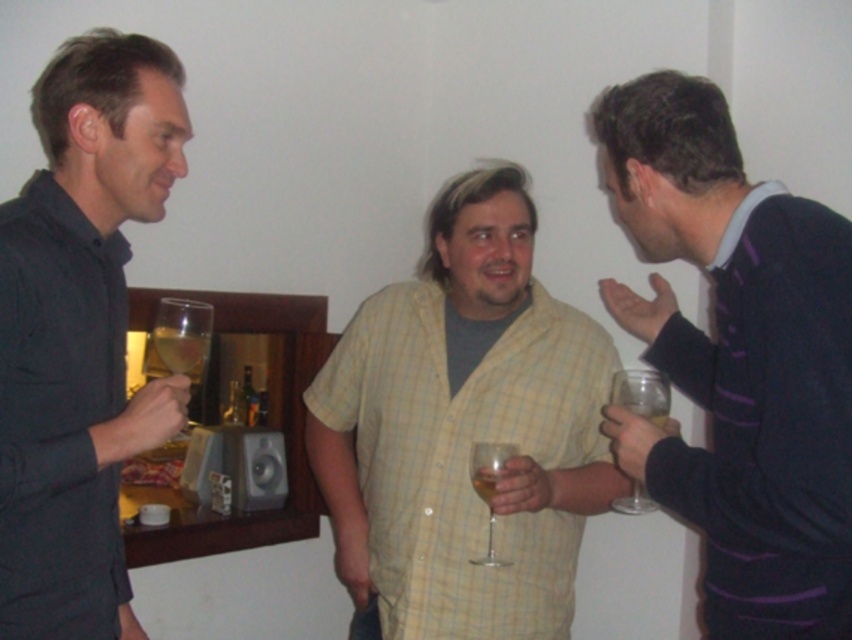
Is dark blue sweater at right smaller than translucent glass wine at left?

No, dark blue sweater at right is not smaller than translucent glass wine at left.

Who is more forward, (x=631, y=150) or (x=183, y=346)?

Point (x=631, y=150) is in front.

Image resolution: width=852 pixels, height=640 pixels. I want to click on dark blue sweater at right, so click(x=737, y=360).

At what (x,y) coordinates should I click in order to perform the action: click on dark blue sweater at right. Please return your answer as a coordinate pair (x, y). Looking at the image, I should click on (737, 360).

Is the position of translucent glass wine glass at center more distant than that of translucent glass wine at left?

That is True.

Which is more to the right, translucent glass wine glass at center or translucent glass wine at left?

From the viewer's perspective, translucent glass wine glass at center appears more on the right side.

This screenshot has height=640, width=852. Find the location of `translucent glass wine glass at center`. translucent glass wine glass at center is located at coordinates (488, 486).

Is point (7, 272) positioned before point (164, 328)?

Yes, point (7, 272) is closer to viewer.

Does dark gray shirt at left come in front of clear glass wine glass at left?

Yes.

Does point (131, 156) come closer to viewer compared to point (190, 308)?

Yes, point (131, 156) is in front of point (190, 308).

The width and height of the screenshot is (852, 640). I want to click on dark gray shirt at left, so click(79, 333).